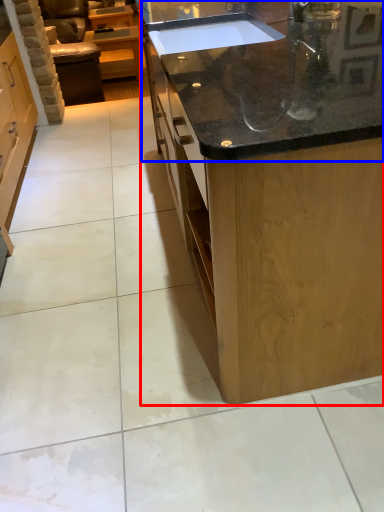
Question: Which point is closer to the camera, countertop (highlighted by a red box) or countertop (highlighted by a blue box)?

Choices:
 (A) countertop
 (B) countertop

Answer: (A)